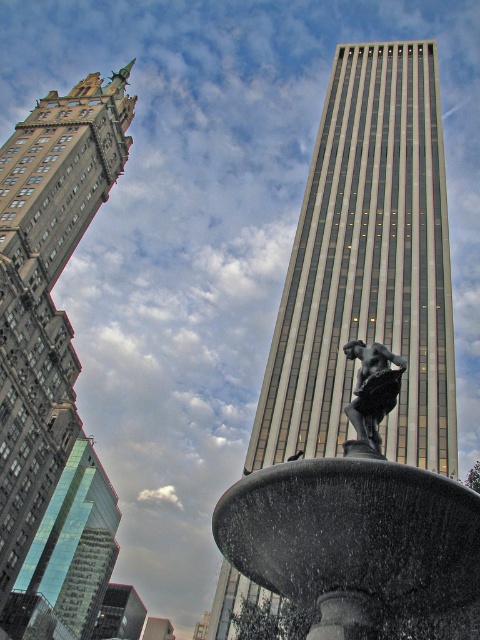
Question: Among these objects, which one is nearest to the camera?

Choices:
 (A) gray metallic skyscraper at center
 (B) green glass skyscraper at lower left

Answer: (A)

Question: Which object is positioned farthest from the green glass skyscraper at lower left?

Choices:
 (A) gray metallic skyscraper at center
 (B) bronze statue at center
 (C) polished bronze statue at center

Answer: (B)

Question: Is green glass building at left bigger than bronze statue at center?

Choices:
 (A) yes
 (B) no

Answer: (A)

Question: Is green glass building at left above bronze statue at center?

Choices:
 (A) no
 (B) yes

Answer: (B)

Question: Is green glass skyscraper at lower left closer to the viewer compared to bronze statue at center?

Choices:
 (A) yes
 (B) no

Answer: (B)

Question: Among these points, which one is nearest to the camera?

Choices:
 (A) (297, 520)
 (B) (4, 604)

Answer: (A)